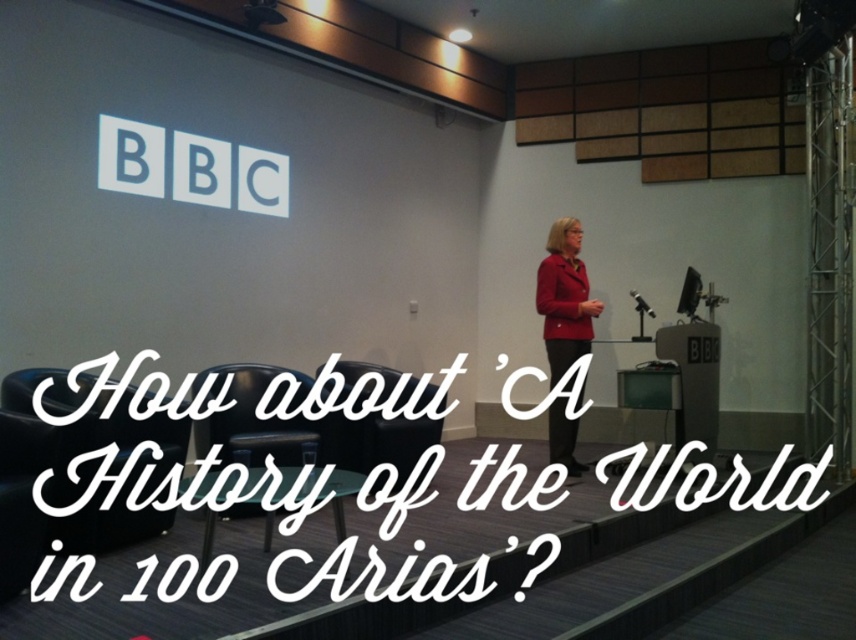
In the scene shown: You are a stagehand preparing to adjust the microphone stand. You need to move it closer to the red smooth jacket at center without moving the black leather chair at center. Which direction should you move the microphone stand?

The red smooth jacket at center is further to the viewer than the black leather chair at center. To move the microphone stand closer to the red smooth jacket at center without moving the black leather chair at center, you should move the microphone stand forward towards the front of the stage.

You are a technician in a BBC studio and need to place a new monitor exactly at the same 2D coordinates as the black plastic projector at upper center. What are the coordinates you should use?

The coordinates for the black plastic projector at upper center are 0.020 and 0.307, so you should place the new monitor at the same point, which is 0.020 in the x and 0.307 in the y.

You are standing on the stage in the BBC studio and want to move from one point to another. You have to choose between moving to point A at coordinates point A at point (207, 515) and point B at point (687, 300). Which point is closer to you if you are facing the audience?

Point A at point (207, 515) is closer to the viewer than point B at point (687, 300).